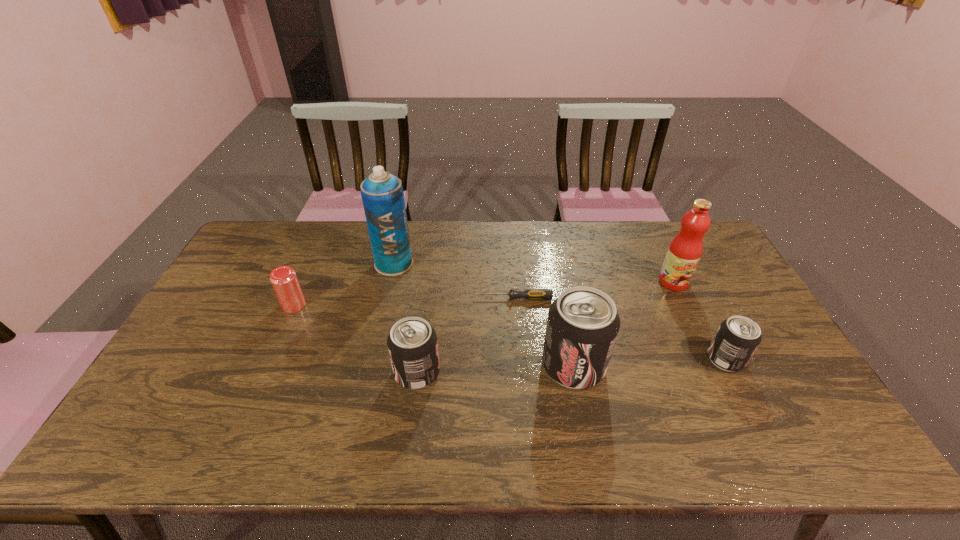
Where is `the leftmost soda can`? the leftmost soda can is located at coordinates (412, 343).

Find the location of a particular element. the second tallest soda can is located at coordinates (412, 343).

Locate an element on the screen. The image size is (960, 540). the second soda can from right to left is located at coordinates (582, 326).

Identify the location of the tallest soda can. (582, 326).

Locate an element on the screen. the rightmost soda can is located at coordinates pyautogui.click(x=737, y=338).

This screenshot has height=540, width=960. Identify the location of the sixth shortest object. (685, 250).

Image resolution: width=960 pixels, height=540 pixels. I want to click on aerosol can, so click(382, 194).

You are a GUI agent. You are given a task and a screenshot of the screen. Output one action in this format:
    pyautogui.click(x=<x>, y=<y>)
    Task: Click on the beer can
    The image size is (960, 540).
    Given the screenshot: What is the action you would take?
    pyautogui.click(x=284, y=280)

You are a GUI agent. You are given a task and a screenshot of the screen. Output one action in this format:
    pyautogui.click(x=<x>, y=<y>)
    Task: Click on the screwdriver
    
    Given the screenshot: What is the action you would take?
    pyautogui.click(x=532, y=294)

Identify the location of free region located 0.190m on the right of the leftmost soda can. (512, 373).